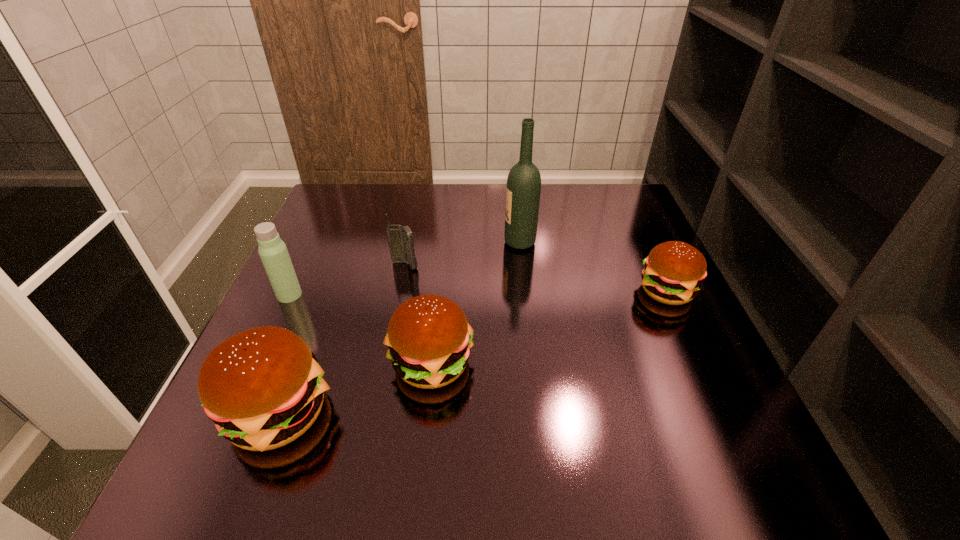
Please determine a free point for an extra hamburger to ensure balance. Please provide its 2D coordinates. Your answer should be formatted as a tuple, i.e. [(x, y)], where the tuple contains the x and y coordinates of a point satisfying the conditions above.

[(559, 324)]